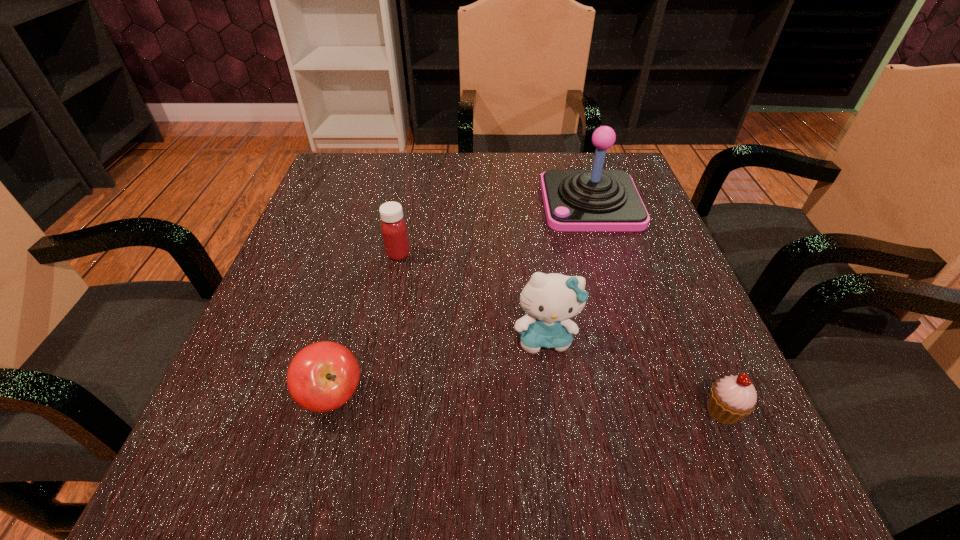
Identify the location of the tallest object. The image size is (960, 540). (575, 200).

Identify the location of the farthest object. (575, 200).

I want to click on the third farthest object, so click(549, 300).

Where is `kitten`? Image resolution: width=960 pixels, height=540 pixels. kitten is located at coordinates pyautogui.click(x=549, y=300).

Identify the location of medicine. The width and height of the screenshot is (960, 540). (393, 227).

At what (x,y) coordinates should I click in order to perform the action: click on apple. Please return your answer as a coordinate pair (x, y). The image size is (960, 540). Looking at the image, I should click on (323, 376).

I want to click on cupcake, so click(x=732, y=398).

The width and height of the screenshot is (960, 540). What are the coordinates of `free location located forward from the base of the farthest object` in the screenshot? It's located at (370, 202).

At what (x,y) coordinates should I click in order to perform the action: click on vacant space situated forward from the base of the farthest object. Please return your answer as a coordinate pair (x, y). The width and height of the screenshot is (960, 540). Looking at the image, I should click on (405, 202).

Locate an element on the screen. The height and width of the screenshot is (540, 960). vacant space located forward from the base of the farthest object is located at coordinates (374, 202).